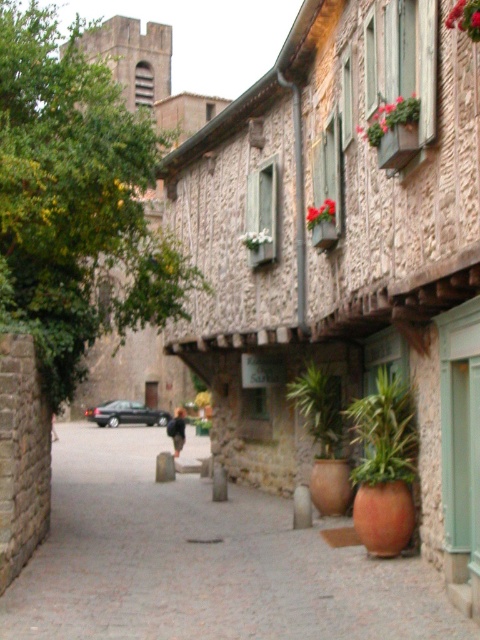
You are a window cleaner needing to reach both the green textured planter at upper center and the green textured planter at center. Which planter will require a taller ladder because of its height?

The green textured planter at upper center requires a taller ladder because it is larger in size than the green textured planter at center, implying it is positioned higher up.

You are a tourist standing in front of the building with flower boxes and plants. You notice the green textured plant at upper right and the green textured planter at center. Which one is nearer to you?

The green textured plant at upper right is closer to the viewer than the green textured planter at center.